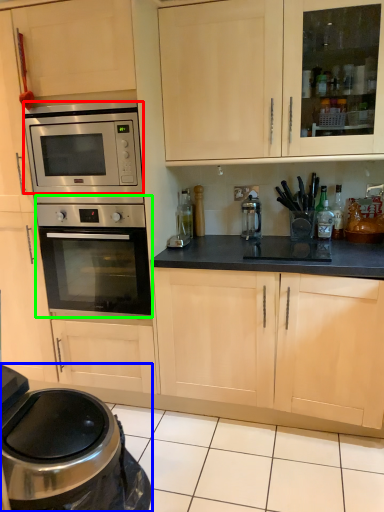
Question: Which object is the farthest from microwave oven (highlighted by a red box)? Choose among these: home appliance (highlighted by a blue box) or oven (highlighted by a green box).

Choices:
 (A) home appliance
 (B) oven

Answer: (A)